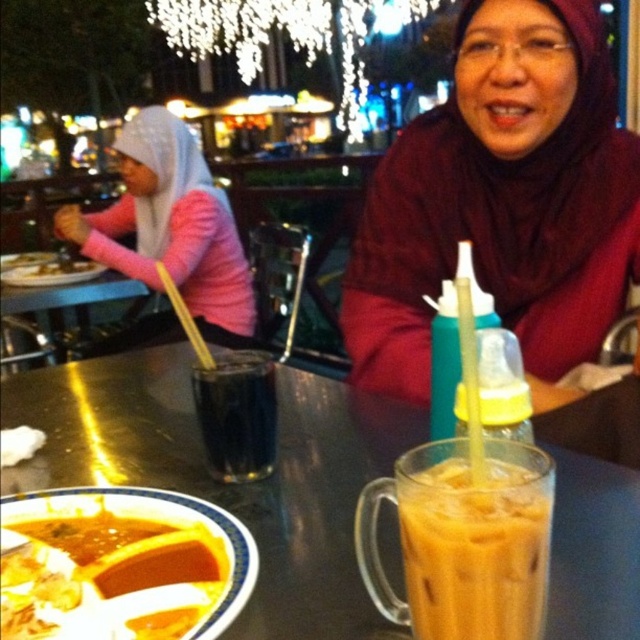
You are a photographer setting up a camera at the scene. You need to focus on both the pink fabric hijab at upper left and the black glass at center. Which object should you adjust the focus to first if you want to capture both clearly in the same shot?

The pink fabric hijab at upper left is larger in size than the black glass at center, so you should focus on the pink fabric hijab at upper left first to ensure its details are sharp before adjusting for the smaller black glass at center.